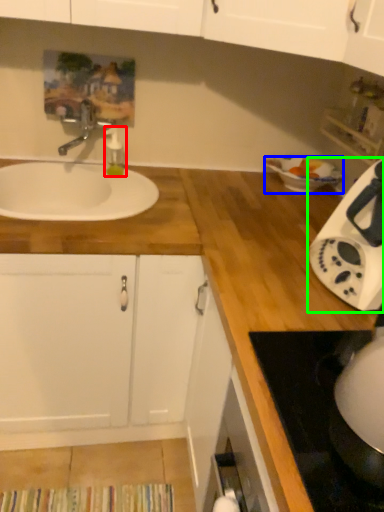
Question: Based on their relative distances, which object is farther from soap dispenser (highlighted by a red box)? Choose from basin (highlighted by a blue box) and home appliance (highlighted by a green box).

Choices:
 (A) basin
 (B) home appliance

Answer: (B)